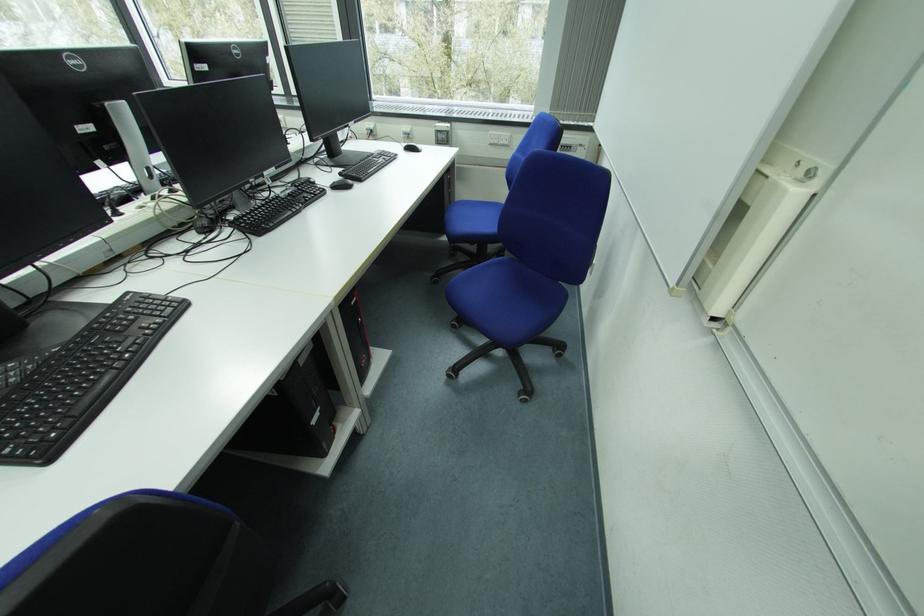
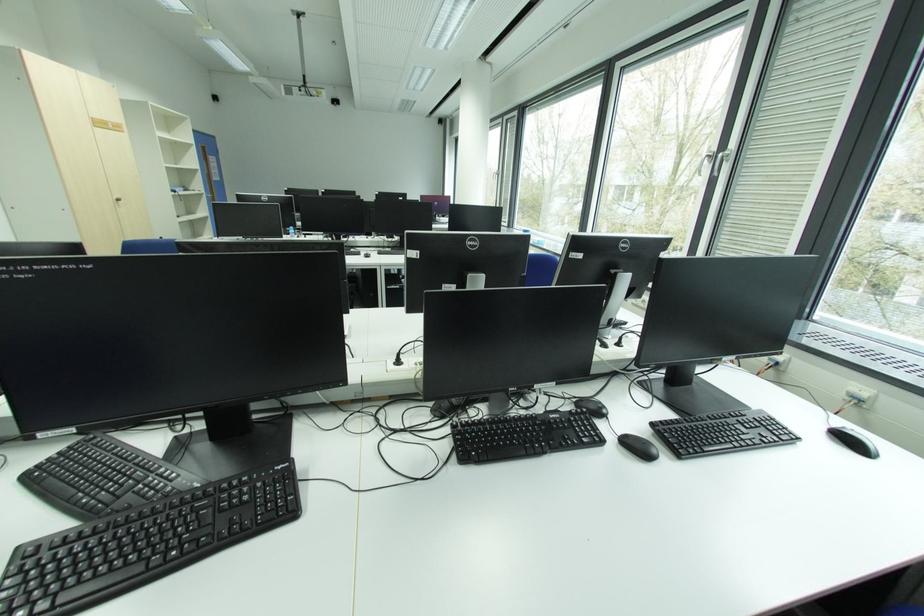
Where in the second image is the point corresponding to pixel 342 185 from the first image?

(634, 442)